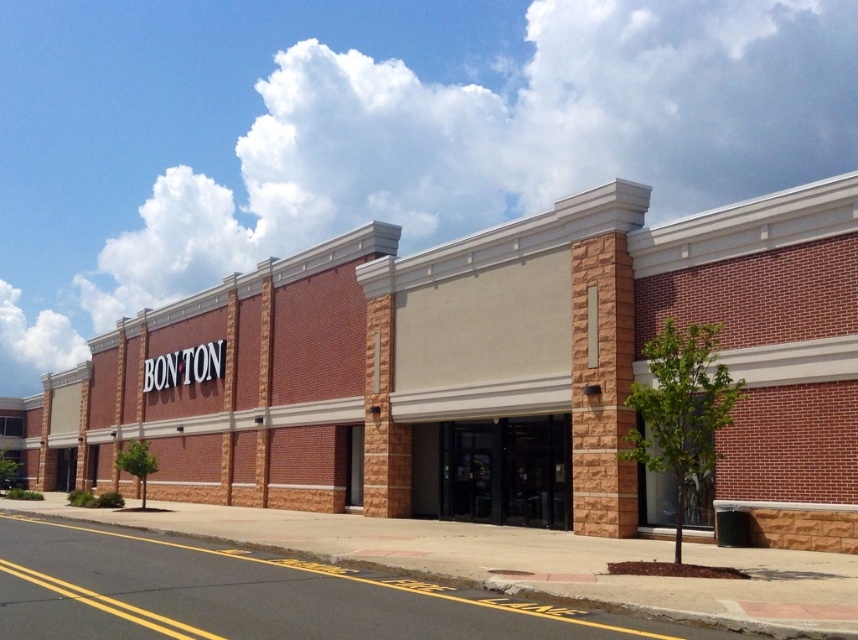
Question: Among these objects, which one is nearest to the camera?

Choices:
 (A) black glass doors at center
 (B) brick building at center

Answer: (B)

Question: Does brick building at center have a greater width compared to black glass doors at center?

Choices:
 (A) yes
 (B) no

Answer: (A)

Question: Does brick building at center have a lesser width compared to black glass doors at center?

Choices:
 (A) yes
 (B) no

Answer: (B)

Question: Is brick building at center thinner than black glass doors at center?

Choices:
 (A) yes
 (B) no

Answer: (B)

Question: Which point appears closest to the camera in this image?

Choices:
 (A) (509, 230)
 (B) (454, 515)

Answer: (A)